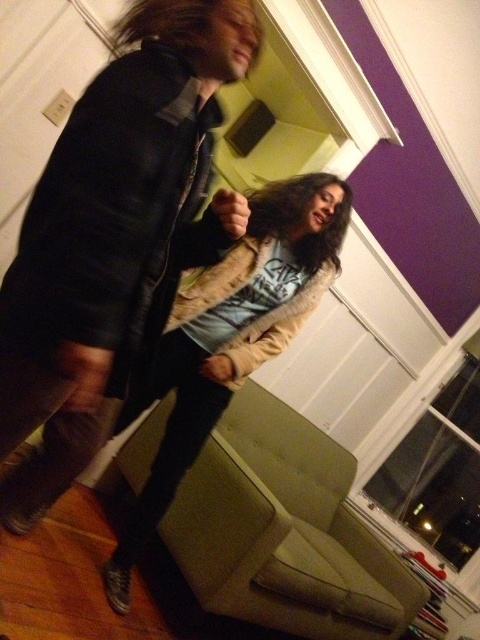
Does point (105, 264) come behind point (186, 326)?

That is False.

Is black leather jacket at upper left thinner than fuzzy beige coat at center?

Yes.

Is point (215, 124) farther from viewer compared to point (276, 241)?

No, it is not.

Locate an element on the screen. The image size is (480, 640). black leather jacket at upper left is located at coordinates (117, 230).